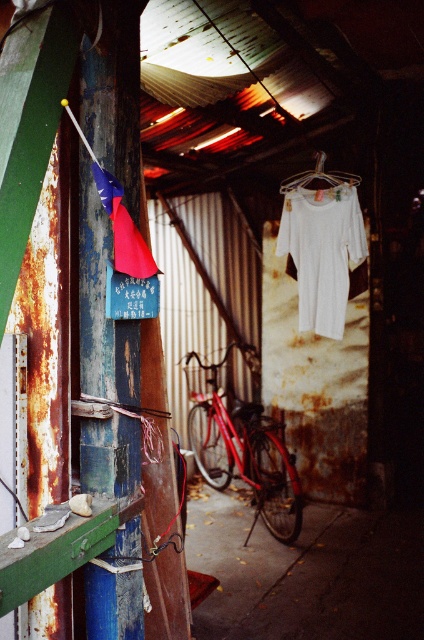
Question: Does rusty wood pole at left appear over white cotton pants at center?

Choices:
 (A) yes
 (B) no

Answer: (B)

Question: Based on their relative distances, which object is nearer to the white cotton pants at center?

Choices:
 (A) rusty wood pole at left
 (B) shiny red bicycle at center

Answer: (B)

Question: Which of the following is the farthest from the observer?

Choices:
 (A) shiny red bicycle at center
 (B) rusty wood pole at left

Answer: (A)

Question: Is white cotton pants at center to the right of white fabric at center from the viewer's perspective?

Choices:
 (A) yes
 (B) no

Answer: (A)

Question: Does rusty wood pole at left have a larger size compared to white cotton pants at center?

Choices:
 (A) no
 (B) yes

Answer: (A)

Question: Which point is farther to the camera?

Choices:
 (A) [349, 177]
 (B) [195, 400]
 (C) [326, 330]
 (D) [134, 468]

Answer: (B)